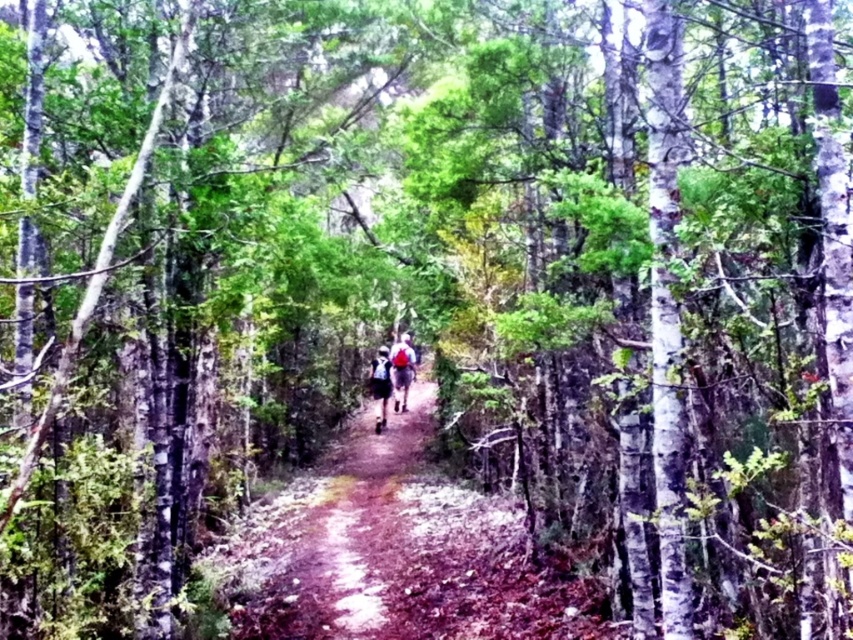
Who is more forward, (300, 625) or (373, 360)?

Point (300, 625)

Can you confirm if brown dirt path at center is wider than dark blue backpack at center?

Yes.

Locate an element on the screen. brown dirt path at center is located at coordinates (331, 540).

Find the location of a particular element. brown dirt path at center is located at coordinates (331, 540).

Who is higher up, red backpack at center or dark blue backpack at center?

red backpack at center is above.

Is red backpack at center taller than dark blue backpack at center?

In fact, red backpack at center may be shorter than dark blue backpack at center.

Is point (410, 362) positioned behind point (379, 419)?

No, (410, 362) is in front of (379, 419).

Identify the location of red backpack at center. (401, 371).

Does brown dirt path at center have a greater height compared to red backpack at center?

In fact, brown dirt path at center may be shorter than red backpack at center.

Who is shorter, brown dirt path at center or red backpack at center?

Standing shorter between the two is brown dirt path at center.

Based on the photo, who is more forward, (x=347, y=618) or (x=399, y=348)?

Point (x=347, y=618)

The width and height of the screenshot is (853, 640). I want to click on brown dirt path at center, so click(331, 540).